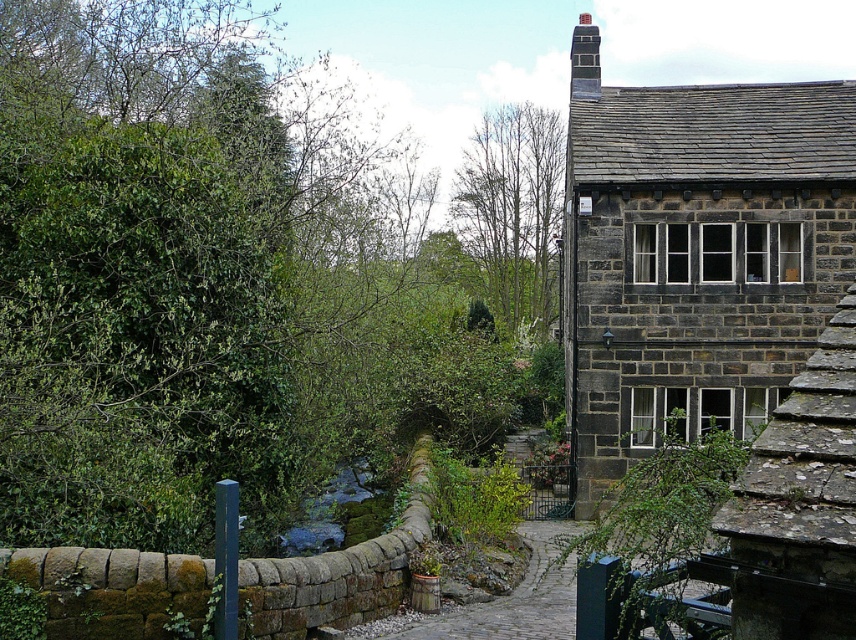
You are a bird looking for a place to perch. You see the green leafy tree at upper left and the green leafy tree at upper center. Which tree would you choose if you want to land on the bigger one?

The green leafy tree at upper left is larger in size than the green leafy tree at upper center, so you should choose the green leafy tree at upper left to land on.